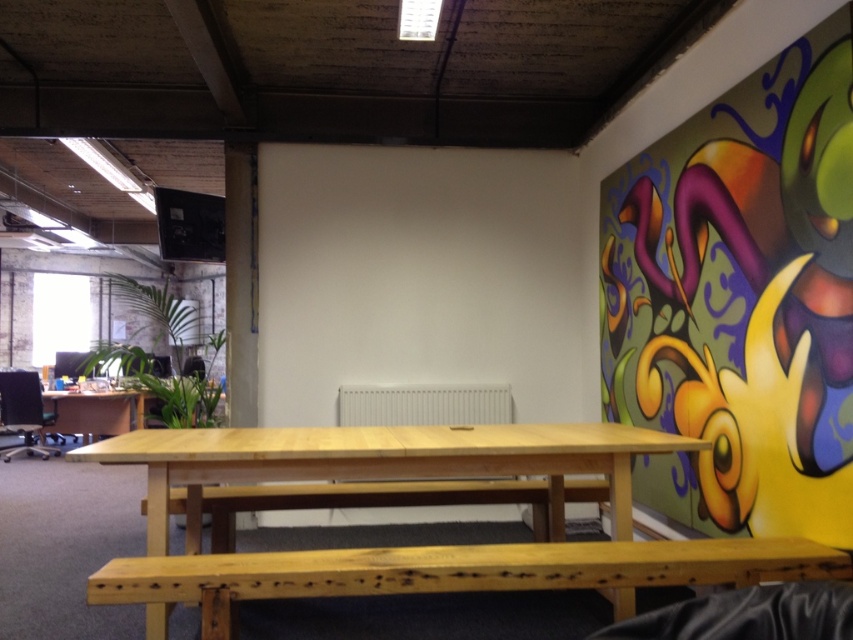
Question: Is multicolored painted wall art at right smaller than natural wood bench at lower center?

Choices:
 (A) no
 (B) yes

Answer: (A)

Question: Which point is closer to the camera?

Choices:
 (A) natural wood bench at center
 (B) natural wood table at center

Answer: (B)

Question: Which of the following is the farthest from the observer?

Choices:
 (A) natural wood table at center
 (B) multicolored painted wall art at right
 (C) natural wood bench at center

Answer: (C)

Question: Which point appears closest to the camera in this image?

Choices:
 (A) pyautogui.click(x=844, y=259)
 (B) pyautogui.click(x=496, y=454)
 (C) pyautogui.click(x=364, y=484)
 (D) pyautogui.click(x=432, y=589)

Answer: (D)

Question: Does natural wood bench at lower center appear on the right side of natural wood bench at center?

Choices:
 (A) no
 (B) yes

Answer: (B)

Question: In this image, where is natural wood bench at lower center located relative to natural wood bench at center?

Choices:
 (A) above
 (B) below

Answer: (A)